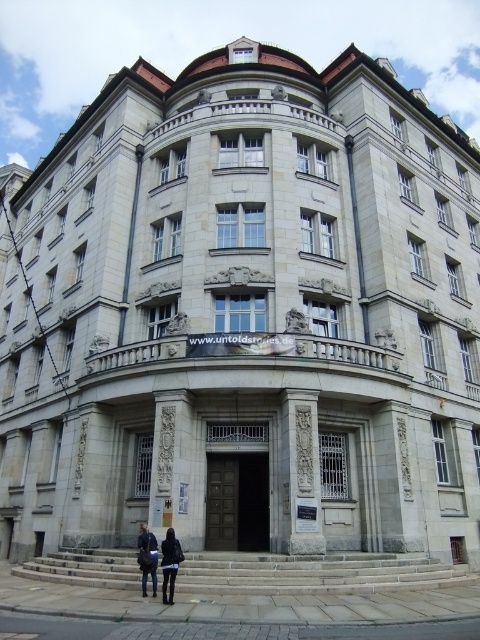
Question: Which of these objects is positioned farthest from the dark wood door at center?

Choices:
 (A) dark gray fabric coat at lower center
 (B) dark blue leather jacket at lower center
 (C) dark blue jeans at lower center

Answer: (B)

Question: Does dark gray fabric coat at lower center have a lesser width compared to dark blue leather jacket at lower center?

Choices:
 (A) yes
 (B) no

Answer: (B)

Question: Which object is closer to the camera taking this photo?

Choices:
 (A) dark blue leather jacket at lower center
 (B) dark wood door at center
 (C) dark gray fabric coat at lower center

Answer: (C)

Question: Is dark wood door at center positioned at the back of dark blue leather jacket at lower center?

Choices:
 (A) yes
 (B) no

Answer: (A)

Question: From the image, what is the correct spatial relationship of dark gray fabric coat at lower center in relation to dark blue jeans at lower center?

Choices:
 (A) below
 (B) above

Answer: (B)

Question: Which object is closer to the camera taking this photo?

Choices:
 (A) dark blue leather jacket at lower center
 (B) dark blue jeans at lower center

Answer: (A)